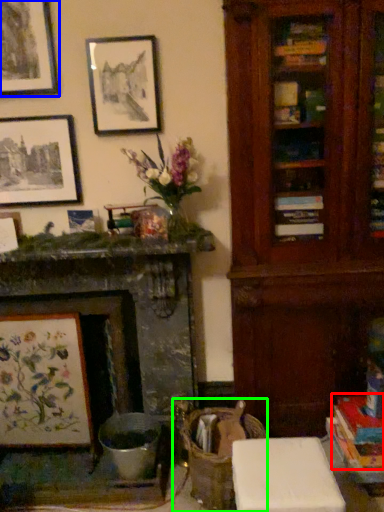
Question: Estimate the real-world distances between objects in this image. Which object is closer to book (highlighted by a red box), picture frame (highlighted by a blue box) or swivel chair (highlighted by a green box)?

Choices:
 (A) picture frame
 (B) swivel chair

Answer: (B)